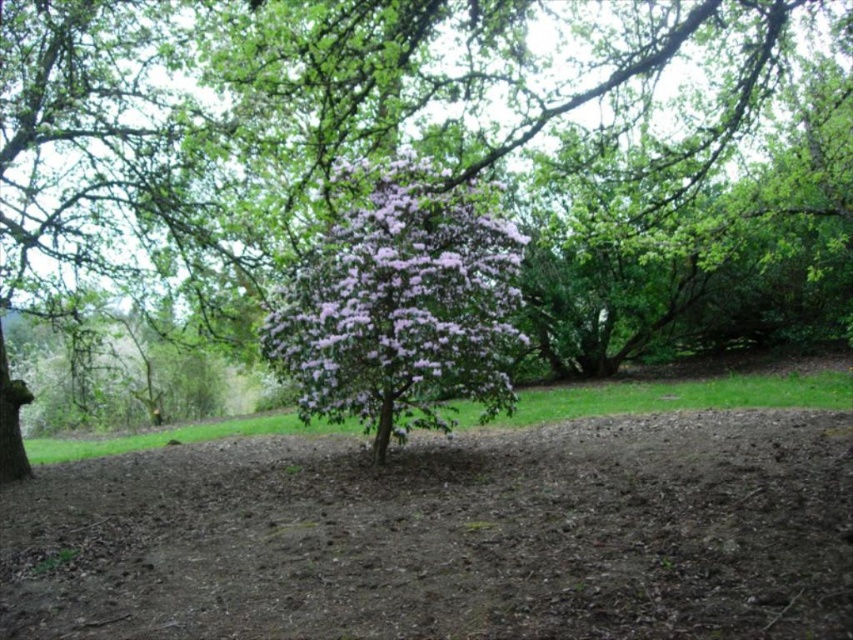
Can you confirm if brown/dry soil at center is shorter than purple leafy bush at center?

Correct, brown/dry soil at center is not as tall as purple leafy bush at center.

Can you confirm if brown/dry soil at center is positioned below purple leafy bush at center?

Yes, brown/dry soil at center is below purple leafy bush at center.

Is point (784, 449) farther from camera compared to point (393, 419)?

That is False.

Identify the location of brown/dry soil at center. This screenshot has height=640, width=853. (445, 536).